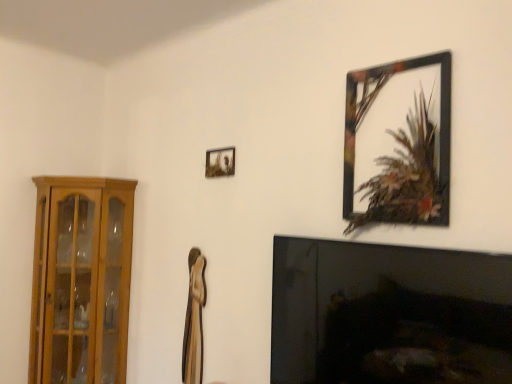
The height and width of the screenshot is (384, 512). What are the coordinates of `metallic black picture frame at upper right, the 2th picture frame when ordered from back to front` in the screenshot? It's located at (399, 142).

Identify the location of metallic silver photo frame at upper center, placed as the first picture frame when sorted from back to front. (220, 162).

In order to face metallic silver photo frame at upper center, positioned as the 1th picture frame in left-to-right order, should I rotate leftwards or rightwards?

To face it directly, rotate left by 4.928 degrees.

What do you see at coordinates (81, 279) in the screenshot? I see `wooden cabinet at left` at bounding box center [81, 279].

Find the location of a particular element. The width and height of the screenshot is (512, 384). metallic black picture frame at upper right, the 2th picture frame when ordered from back to front is located at coordinates (399, 142).

Between metallic black picture frame at upper right, the first picture frame viewed from the front, and black glass fireplace at lower right, which one has less height?

metallic black picture frame at upper right, the first picture frame viewed from the front.

At what (x,y) coordinates should I click in order to perform the action: click on picture frame on the right side of black glass fireplace at lower right. Please return your answer as a coordinate pair (x, y). The width and height of the screenshot is (512, 384). Looking at the image, I should click on (399, 142).

From the picture: Is metallic black picture frame at upper right, which is the second picture frame in left-to-right order, completely or partially outside of black glass fireplace at lower right?

Absolutely, metallic black picture frame at upper right, which is the second picture frame in left-to-right order, is external to black glass fireplace at lower right.

Between metallic black picture frame at upper right, the 2th picture frame when ordered from back to front, and wooden cabinet at left, which one has larger size?

wooden cabinet at left is bigger.

Which point is more forward, (391, 185) or (125, 306)?

The point (391, 185) is more forward.

Which of these two, metallic black picture frame at upper right, the first picture frame viewed from the front, or wooden cabinet at left, is wider?

wooden cabinet at left.

Between metallic black picture frame at upper right, the first picture frame viewed from the front, and wooden cabinet at left, which one appears on the right side from the viewer's perspective?

metallic black picture frame at upper right, the first picture frame viewed from the front, is more to the right.

Would you say metallic silver photo frame at upper center, positioned as the 1th picture frame in left-to-right order, is part of wooden cabinet at left's contents?

No, metallic silver photo frame at upper center, positioned as the 1th picture frame in left-to-right order, is not a part of wooden cabinet at left.

From a real-world perspective, is wooden cabinet at left physically located above or below metallic silver photo frame at upper center, placed as the first picture frame when sorted from back to front?

In terms of real-world spatial position, wooden cabinet at left is below metallic silver photo frame at upper center, placed as the first picture frame when sorted from back to front.

Is wooden cabinet at left facing away from metallic silver photo frame at upper center, placed as the first picture frame when sorted from back to front?

No, wooden cabinet at left is not facing away from metallic silver photo frame at upper center, placed as the first picture frame when sorted from back to front.

Is the surface of wooden cabinet at left in direct contact with metallic silver photo frame at upper center, which appears as the 2th picture frame when viewed from the right?

They are not placed beside each other.

Is black glass fireplace at lower right aimed at metallic silver photo frame at upper center, positioned as the 1th picture frame in left-to-right order?

No, black glass fireplace at lower right does not turn towards metallic silver photo frame at upper center, positioned as the 1th picture frame in left-to-right order.

Looking at their sizes, would you say black glass fireplace at lower right is wider or thinner than metallic silver photo frame at upper center, placed as the first picture frame when sorted from back to front?

Clearly, black glass fireplace at lower right has more width compared to metallic silver photo frame at upper center, placed as the first picture frame when sorted from back to front.

Which is behind, point (459, 282) or point (234, 150)?

Point (234, 150)

From a real-world perspective, which object rests below the other?

black glass fireplace at lower right.

Is black glass fireplace at lower right taller than wooden cabinet at left?

Incorrect, the height of black glass fireplace at lower right is not larger of that of wooden cabinet at left.

Is black glass fireplace at lower right not within wooden cabinet at left?

black glass fireplace at lower right is positioned outside wooden cabinet at left.

Considering the relative sizes of black glass fireplace at lower right and wooden cabinet at left in the image provided, is black glass fireplace at lower right bigger than wooden cabinet at left?

Incorrect, black glass fireplace at lower right is not larger than wooden cabinet at left.

From a real-world perspective, which is physically below, black glass fireplace at lower right or wooden cabinet at left?

wooden cabinet at left.

Is metallic black picture frame at upper right, which is the first picture frame in right-to-left order, facing away from metallic silver photo frame at upper center, positioned as the 1th picture frame in left-to-right order?

No, metallic black picture frame at upper right, which is the first picture frame in right-to-left order,'s orientation is not away from metallic silver photo frame at upper center, positioned as the 1th picture frame in left-to-right order.

This screenshot has height=384, width=512. I want to click on picture frame that appears below the metallic black picture frame at upper right, which is the first picture frame in right-to-left order (from a real-world perspective), so click(220, 162).

Is metallic black picture frame at upper right, the 2th picture frame when ordered from back to front, with metallic silver photo frame at upper center, positioned as the 1th picture frame in left-to-right order?

No, metallic black picture frame at upper right, the 2th picture frame when ordered from back to front, is not with metallic silver photo frame at upper center, positioned as the 1th picture frame in left-to-right order.

Does metallic black picture frame at upper right, the first picture frame viewed from the front, have a larger size compared to metallic silver photo frame at upper center, which appears as the 2th picture frame when viewed from the right?

Correct, metallic black picture frame at upper right, the first picture frame viewed from the front, is larger in size than metallic silver photo frame at upper center, which appears as the 2th picture frame when viewed from the right.

Is metallic silver photo frame at upper center, the second picture frame viewed from the front, placed right next to black glass fireplace at lower right?

No, metallic silver photo frame at upper center, the second picture frame viewed from the front, is not touching black glass fireplace at lower right.

Which object is positioned more to the left, metallic silver photo frame at upper center, positioned as the 1th picture frame in left-to-right order, or black glass fireplace at lower right?

Positioned to the left is metallic silver photo frame at upper center, positioned as the 1th picture frame in left-to-right order.

Is metallic silver photo frame at upper center, the second picture frame viewed from the front, inside the boundaries of black glass fireplace at lower right, or outside?

metallic silver photo frame at upper center, the second picture frame viewed from the front, exists outside the volume of black glass fireplace at lower right.

You are a GUI agent. You are given a task and a screenshot of the screen. Output one action in this format:
    pyautogui.click(x=<x>, y=<y>)
    Task: Click on the fireplace that appears in front of the metallic black picture frame at upper right, the first picture frame viewed from the front
    The height and width of the screenshot is (384, 512).
    Given the screenshot: What is the action you would take?
    pyautogui.click(x=389, y=314)

Where is `picture frame that is the 2nd one when counting rightward from the wooden cabinet at left`? Image resolution: width=512 pixels, height=384 pixels. picture frame that is the 2nd one when counting rightward from the wooden cabinet at left is located at coordinates (399, 142).

From the image, which object appears to be farther from metallic black picture frame at upper right, the 2th picture frame when ordered from back to front, metallic silver photo frame at upper center, placed as the first picture frame when sorted from back to front, or wooden cabinet at left?

The object further to metallic black picture frame at upper right, the 2th picture frame when ordered from back to front, is wooden cabinet at left.

Considering their positions, is metallic black picture frame at upper right, which is the first picture frame in right-to-left order, positioned further to wooden cabinet at left than metallic silver photo frame at upper center, placed as the first picture frame when sorted from back to front?

Based on the image, metallic black picture frame at upper right, which is the first picture frame in right-to-left order, appears to be further to wooden cabinet at left.

Considering their positions, is wooden cabinet at left positioned closer to black glass fireplace at lower right than metallic black picture frame at upper right, the first picture frame viewed from the front?

metallic black picture frame at upper right, the first picture frame viewed from the front, is closer to black glass fireplace at lower right.

Estimate the real-world distances between objects in this image. Which object is further from metallic silver photo frame at upper center, which appears as the 2th picture frame when viewed from the right, metallic black picture frame at upper right, which is the second picture frame in left-to-right order, or wooden cabinet at left?

wooden cabinet at left is further to metallic silver photo frame at upper center, which appears as the 2th picture frame when viewed from the right.

From the image, which object appears to be nearer to black glass fireplace at lower right, metallic black picture frame at upper right, which is the first picture frame in right-to-left order, or metallic silver photo frame at upper center, which appears as the 2th picture frame when viewed from the right?

metallic black picture frame at upper right, which is the first picture frame in right-to-left order, lies closer to black glass fireplace at lower right than the other object.

From the image, which object appears to be nearer to black glass fireplace at lower right, metallic black picture frame at upper right, the 2th picture frame when ordered from back to front, or wooden cabinet at left?

Among the two, metallic black picture frame at upper right, the 2th picture frame when ordered from back to front, is located nearer to black glass fireplace at lower right.

Looking at this image, which object lies nearer to the anchor point wooden cabinet at left, metallic black picture frame at upper right, the first picture frame viewed from the front, or black glass fireplace at lower right?

Based on the image, black glass fireplace at lower right appears to be nearer to wooden cabinet at left.

Estimate the real-world distances between objects in this image. Which object is further from metallic black picture frame at upper right, which is the first picture frame in right-to-left order, wooden cabinet at left or black glass fireplace at lower right?

wooden cabinet at left lies further to metallic black picture frame at upper right, which is the first picture frame in right-to-left order, than the other object.

Identify the location of picture frame located between black glass fireplace at lower right and metallic silver photo frame at upper center, which appears as the 2th picture frame when viewed from the right, in the depth direction. (399, 142).

Find the location of a particular element. Image resolution: width=512 pixels, height=384 pixels. picture frame situated between wooden cabinet at left and metallic black picture frame at upper right, the 2th picture frame when ordered from back to front, from left to right is located at coordinates (220, 162).

Where is `fireplace between wooden cabinet at left and metallic black picture frame at upper right, the first picture frame viewed from the front`? fireplace between wooden cabinet at left and metallic black picture frame at upper right, the first picture frame viewed from the front is located at coordinates (389, 314).

At what (x,y) coordinates should I click in order to perform the action: click on picture frame between wooden cabinet at left and black glass fireplace at lower right in the horizontal direction. Please return your answer as a coordinate pair (x, y). The width and height of the screenshot is (512, 384). Looking at the image, I should click on (220, 162).